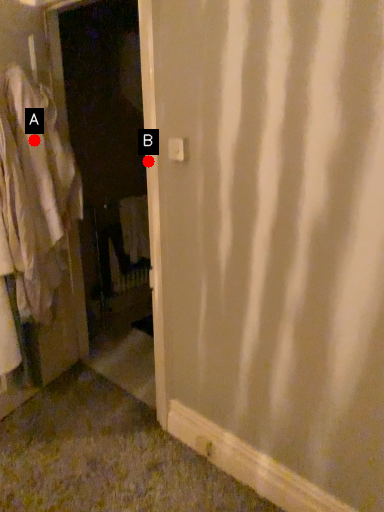
Question: Two points are circled on the image, labeled by A and B beside each circle. Among these points, which one is nearest to the camera?

Choices:
 (A) A is closer
 (B) B is closer

Answer: (B)